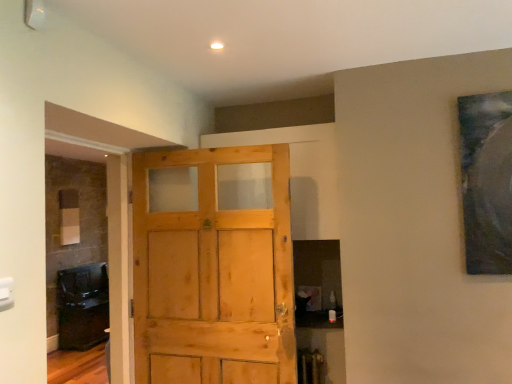
From the picture: In order to face dark brown wood cabinet at left, should I rotate leftwards or rightwards?

Turn left by 21.823 degrees to look at dark brown wood cabinet at left.

This screenshot has height=384, width=512. I want to click on dark brown wood cabinet at left, so click(82, 306).

The image size is (512, 384). What do you see at coordinates (82, 306) in the screenshot?
I see `dark brown wood cabinet at left` at bounding box center [82, 306].

The height and width of the screenshot is (384, 512). What are the coordinates of `light brown wood door at center` in the screenshot? It's located at (213, 277).

This screenshot has width=512, height=384. What do you see at coordinates (213, 277) in the screenshot?
I see `light brown wood door at center` at bounding box center [213, 277].

Identify the location of dark brown wood cabinet at left. (82, 306).

Is dark brown wood cabinet at left to the right of light brown wood door at center from the viewer's perspective?

No, dark brown wood cabinet at left is not to the right of light brown wood door at center.

Is dark brown wood cabinet at left positioned before light brown wood door at center?

No, it is not.

Does point (96, 335) lie behind point (248, 264)?

Yes, point (96, 335) is behind point (248, 264).

From the image's perspective, is dark brown wood cabinet at left positioned above or below light brown wood door at center?

Based on their image positions, dark brown wood cabinet at left is located beneath light brown wood door at center.

From a real-world perspective, is dark brown wood cabinet at left positioned above or below light brown wood door at center?

dark brown wood cabinet at left is below light brown wood door at center.

Which object is wider, dark brown wood cabinet at left or light brown wood door at center?

Wider between the two is dark brown wood cabinet at left.

Can you confirm if dark brown wood cabinet at left is taller than light brown wood door at center?

Incorrect, the height of dark brown wood cabinet at left is not larger of that of light brown wood door at center.

Which of these two, dark brown wood cabinet at left or light brown wood door at center, is smaller?

light brown wood door at center is smaller.

Is dark brown wood cabinet at left outside of light brown wood door at center?

Indeed, dark brown wood cabinet at left is completely outside light brown wood door at center.

Is dark brown wood cabinet at left not close to light brown wood door at center?

Yes, dark brown wood cabinet at left and light brown wood door at center are quite far apart.

Is dark brown wood cabinet at left turned away from light brown wood door at center?

dark brown wood cabinet at left is not turned away from light brown wood door at center.

Find the location of a particular element. This screenshot has height=384, width=512. cabinetry below the light brown wood door at center (from a real-world perspective) is located at coordinates point(82,306).

Which object is positioned more to the left, light brown wood door at center or dark brown wood cabinet at left?

dark brown wood cabinet at left is more to the left.

Is the depth of light brown wood door at center greater than that of dark brown wood cabinet at left?

No, it is not.

Is point (169, 263) positioned in front of point (86, 345)?

Yes.

From the image's perspective, between light brown wood door at center and dark brown wood cabinet at left, who is located below?

dark brown wood cabinet at left, from the image's perspective.

From a real-world perspective, which is physically below, light brown wood door at center or dark brown wood cabinet at left?

dark brown wood cabinet at left is physically lower.

In terms of width, does light brown wood door at center look wider or thinner when compared to dark brown wood cabinet at left?

Considering their sizes, light brown wood door at center looks slimmer than dark brown wood cabinet at left.

Considering the sizes of objects light brown wood door at center and dark brown wood cabinet at left in the image provided, who is shorter, light brown wood door at center or dark brown wood cabinet at left?

dark brown wood cabinet at left.

Who is bigger, light brown wood door at center or dark brown wood cabinet at left?

dark brown wood cabinet at left.

Is light brown wood door at center outside of dark brown wood cabinet at left?

light brown wood door at center is positioned outside dark brown wood cabinet at left.

Is light brown wood door at center far away from dark brown wood cabinet at left?

Indeed, light brown wood door at center is not near dark brown wood cabinet at left.

Is light brown wood door at center oriented away from dark brown wood cabinet at left?

light brown wood door at center is not turned away from dark brown wood cabinet at left.

How different are the orientations of light brown wood door at center and dark brown wood cabinet at left in degrees?

90.2 degrees separate the facing orientations of light brown wood door at center and dark brown wood cabinet at left.

This screenshot has width=512, height=384. I want to click on door located above the dark brown wood cabinet at left (from the image's perspective), so click(213, 277).

What are the coordinates of `cabinetry below the light brown wood door at center (from a real-world perspective)` in the screenshot? It's located at (82, 306).

You are a GUI agent. You are given a task and a screenshot of the screen. Output one action in this format:
    pyautogui.click(x=<x>, y=<y>)
    Task: Click on the cabinetry lying below the light brown wood door at center (from the image's perspective)
    
    Given the screenshot: What is the action you would take?
    pyautogui.click(x=82, y=306)